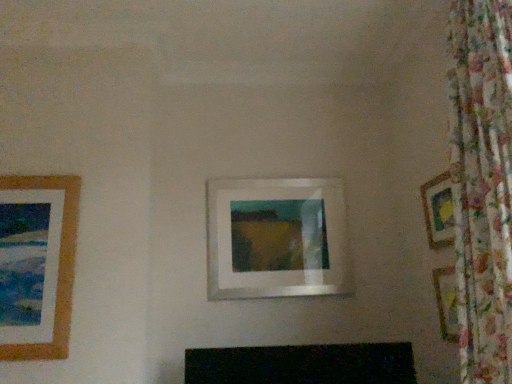
Question: From the image's perspective, relative to white matte picture frame at center, which appears as the second picture frame when viewed from the left, is wooden picture frame at right, which ranks as the third picture frame in left-to-right order, above or below?

Choices:
 (A) below
 (B) above

Answer: (B)

Question: From a real-world perspective, is wooden picture frame at right, which appears as the first picture frame when viewed from the right, positioned above or below white matte picture frame at center, the 2th picture frame viewed from the right?

Choices:
 (A) below
 (B) above

Answer: (B)

Question: Estimate the real-world distances between objects in this image. Which object is closer to the white matte picture frame at center, the 2th picture frame viewed from the right?

Choices:
 (A) brown wooden picture frame at left, which is the third picture frame in right-to-left order
 (B) wooden picture frame at right, which ranks as the third picture frame in left-to-right order

Answer: (B)

Question: Considering the real-world distances, which object is farthest from the wooden picture frame at right, which ranks as the third picture frame in left-to-right order?

Choices:
 (A) white matte picture frame at center, the 2th picture frame viewed from the right
 (B) brown wooden picture frame at left, which is the first picture frame from left to right

Answer: (B)